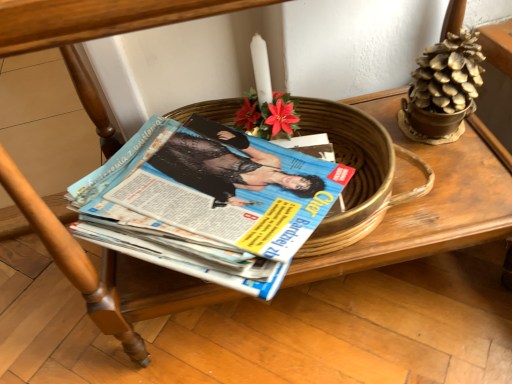
Question: From a real-world perspective, is gold metallic pinecone at upper right under gold metallic flowerpot at upper right?

Choices:
 (A) yes
 (B) no

Answer: (B)

Question: Can you confirm if gold metallic pinecone at upper right is thinner than gold metallic flowerpot at upper right?

Choices:
 (A) no
 (B) yes

Answer: (A)

Question: Considering the relative positions of gold metallic pinecone at upper right and gold metallic flowerpot at upper right in the image provided, is gold metallic pinecone at upper right to the left of gold metallic flowerpot at upper right from the viewer's perspective?

Choices:
 (A) no
 (B) yes

Answer: (B)

Question: Is gold metallic pinecone at upper right oriented towards gold metallic flowerpot at upper right?

Choices:
 (A) yes
 (B) no

Answer: (B)

Question: Considering the relative sizes of gold metallic pinecone at upper right and gold metallic flowerpot at upper right in the image provided, is gold metallic pinecone at upper right smaller than gold metallic flowerpot at upper right?

Choices:
 (A) no
 (B) yes

Answer: (A)

Question: Would you say blue glossy magazine at center is inside or outside gold metallic pinecone at upper right?

Choices:
 (A) outside
 (B) inside

Answer: (A)

Question: Is blue glossy magazine at center bigger or smaller than gold metallic pinecone at upper right?

Choices:
 (A) small
 (B) big

Answer: (B)

Question: Is point (203, 135) positioned closer to the camera than point (465, 107)?

Choices:
 (A) closer
 (B) farther

Answer: (B)

Question: In terms of height, does blue glossy magazine at center look taller or shorter compared to gold metallic pinecone at upper right?

Choices:
 (A) short
 (B) tall

Answer: (A)

Question: Which is correct: gold metallic pinecone at upper right is inside gold metallic flowerpot at upper right, or outside of it?

Choices:
 (A) inside
 (B) outside

Answer: (B)

Question: Does point (455, 74) appear closer or farther from the camera than point (426, 122)?

Choices:
 (A) closer
 (B) farther

Answer: (A)

Question: Looking at their shapes, would you say gold metallic pinecone at upper right is wider or thinner than gold metallic flowerpot at upper right?

Choices:
 (A) wide
 (B) thin

Answer: (A)

Question: Considering the positions of gold metallic pinecone at upper right and gold metallic flowerpot at upper right in the image, is gold metallic pinecone at upper right bigger or smaller than gold metallic flowerpot at upper right?

Choices:
 (A) small
 (B) big

Answer: (B)

Question: Looking at the image, does blue glossy magazine at center seem bigger or smaller compared to gold metallic flowerpot at upper right?

Choices:
 (A) small
 (B) big

Answer: (B)

Question: From a real-world perspective, relative to gold metallic flowerpot at upper right, is blue glossy magazine at center vertically above or below?

Choices:
 (A) below
 (B) above

Answer: (B)